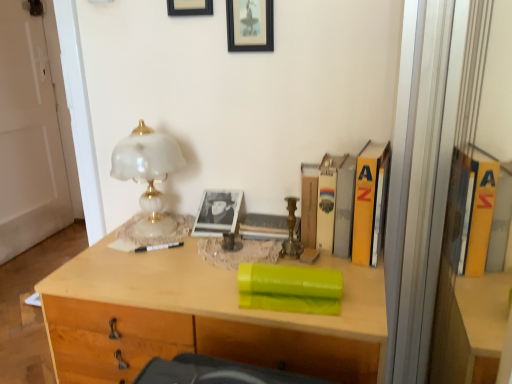
Where is `vacant area to the left of green matte book at center, acting as the 2th book starting from the top`? The width and height of the screenshot is (512, 384). vacant area to the left of green matte book at center, acting as the 2th book starting from the top is located at coordinates (205, 293).